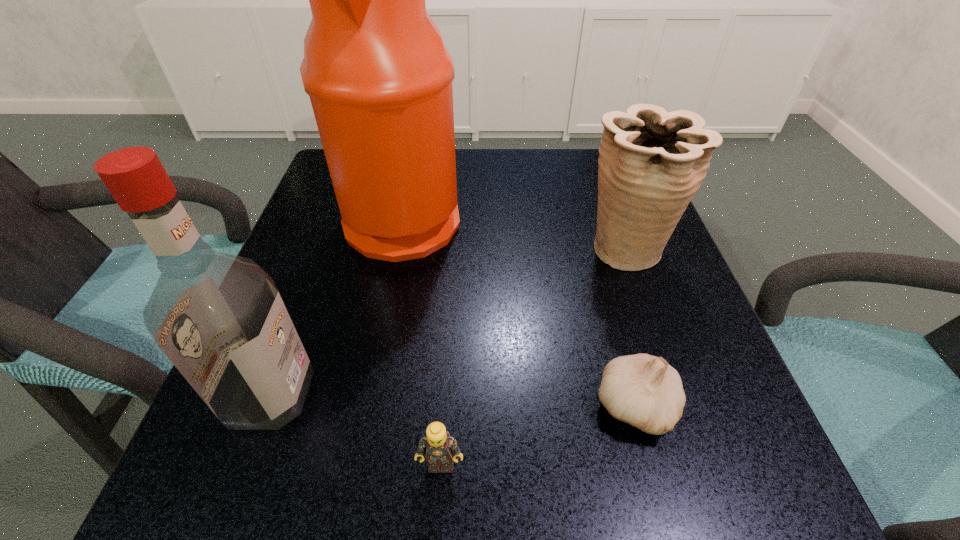
Find the location of `vacant space at the left edge`. vacant space at the left edge is located at coordinates (296, 288).

The image size is (960, 540). Identify the location of free region at the right edge. (687, 288).

Identify the location of free space at the far right corner of the desktop. The height and width of the screenshot is (540, 960). (588, 201).

Locate an element on the screen. The width and height of the screenshot is (960, 540). free space at the near right corner is located at coordinates (637, 442).

Image resolution: width=960 pixels, height=540 pixels. I want to click on blank region between the garlic and the nearest object, so click(538, 435).

The height and width of the screenshot is (540, 960). What are the coordinates of `vacant area between the Lego and the garlic` in the screenshot? It's located at (538, 435).

You are a GUI agent. You are given a task and a screenshot of the screen. Output one action in this format:
    pyautogui.click(x=<x>, y=<y>)
    Task: Click on the free point between the nearest object and the tallest object
    This screenshot has width=960, height=540.
    Given the screenshot: What is the action you would take?
    pyautogui.click(x=422, y=341)

Image resolution: width=960 pixels, height=540 pixels. In order to click on free spot between the urn and the second tallest object in this screenshot , I will do `click(447, 321)`.

Where is `free space that is in between the tallest object and the third shortest object`? free space that is in between the tallest object and the third shortest object is located at coordinates (514, 233).

Find the location of a particular element. This screenshot has height=540, width=960. free space between the liquor and the urn is located at coordinates (447, 321).